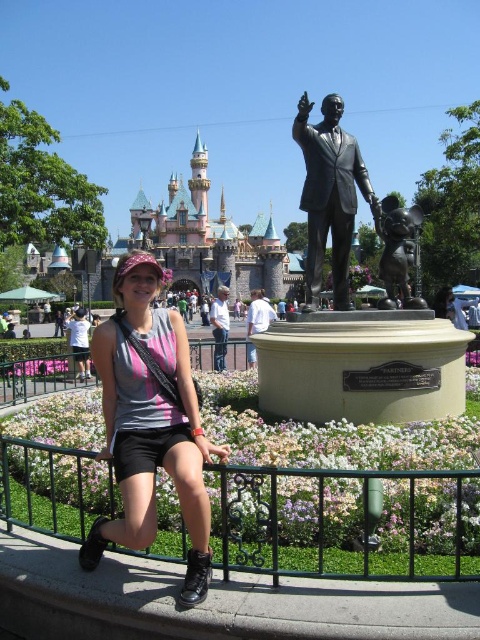
Between pink stone castle at upper center and bronze statue at center, which one appears on the left side from the viewer's perspective?

pink stone castle at upper center

Is the position of pink stone castle at upper center more distant than that of bronze statue at center?

Yes, it is.

Does point (156, 230) come behind point (330, 180)?

Yes, point (156, 230) is behind point (330, 180).

This screenshot has width=480, height=640. In order to click on pink stone castle at upper center in this screenshot , I will do `click(210, 240)`.

Can you confirm if matte gray tank top at center is thinner than bronze mickey mouse statue at center?

No.

Which is below, matte gray tank top at center or bronze mickey mouse statue at center?

Positioned lower is matte gray tank top at center.

Where is `matte gray tank top at center`? matte gray tank top at center is located at coordinates (151, 422).

Where is `matte gray tank top at center`? This screenshot has height=640, width=480. matte gray tank top at center is located at coordinates (151, 422).

Is point (162, 397) farther from camera compared to point (144, 198)?

That is False.

The image size is (480, 640). What do you see at coordinates (151, 422) in the screenshot?
I see `matte gray tank top at center` at bounding box center [151, 422].

I want to click on matte gray tank top at center, so click(151, 422).